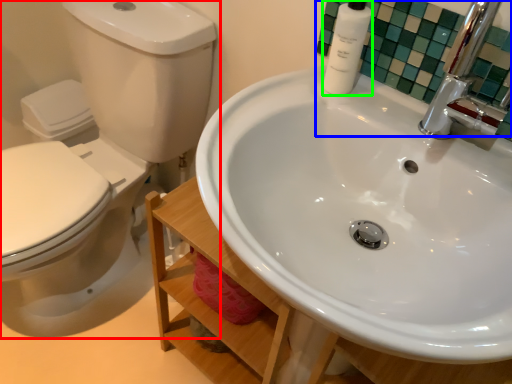
Question: Based on their relative distances, which object is nearer to toilet (highlighted by a red box)? Choose from mirror (highlighted by a blue box) and toiletry (highlighted by a green box).

Choices:
 (A) mirror
 (B) toiletry

Answer: (A)